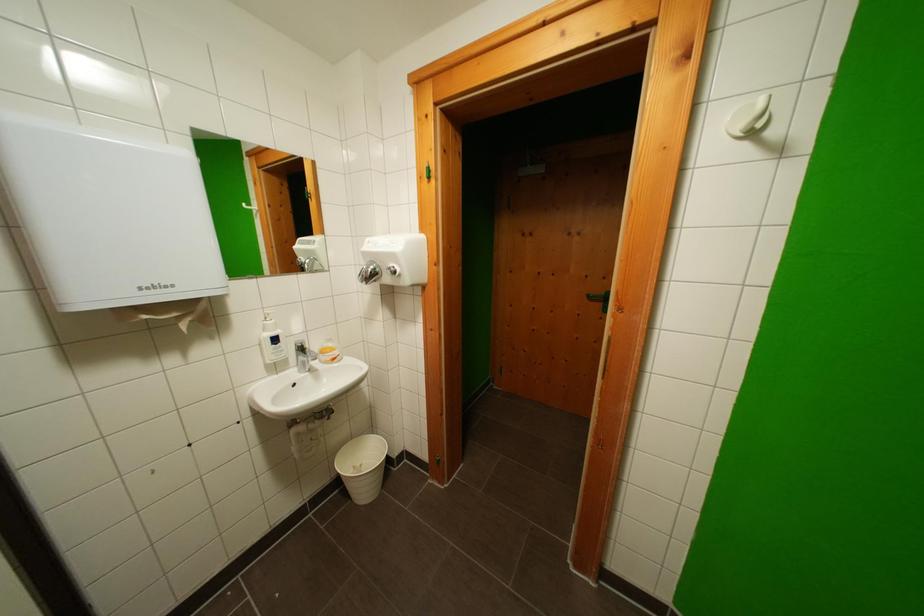
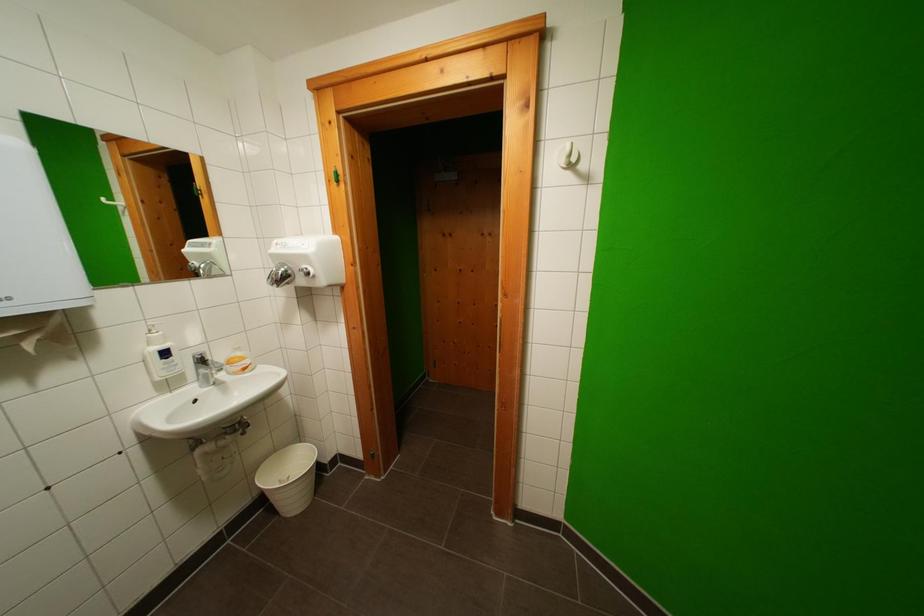
Where in the second image is the point corresponding to point (336, 347) from the first image?

(246, 357)